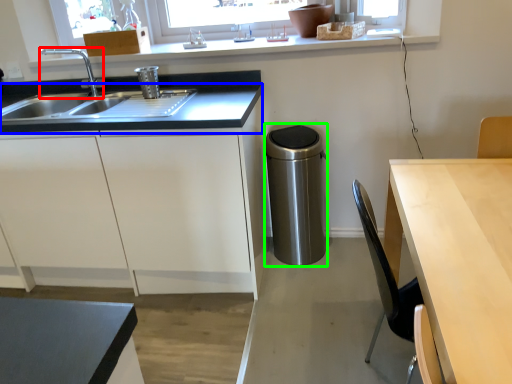
Question: Based on their relative distances, which object is farther from tap (highlighted by a red box)? Choose from countertop (highlighted by a blue box) and appliance (highlighted by a green box).

Choices:
 (A) countertop
 (B) appliance

Answer: (B)